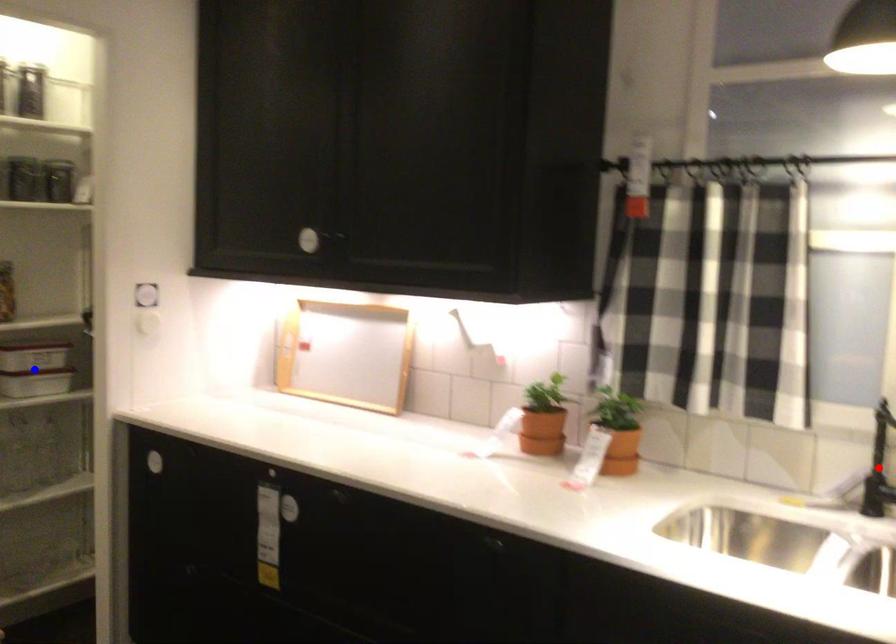
Question: In the image, two points are highlighted. Which point is nearer to the camera? Reply with the corresponding letter.

Choices:
 (A) blue point
 (B) red point

Answer: (B)